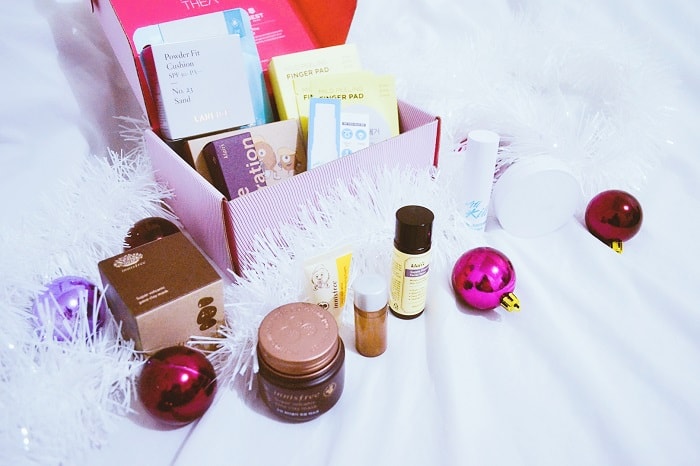
This screenshot has height=466, width=700. What are the coordinates of `pink underside of box lid` in the screenshot? It's located at (287, 21).